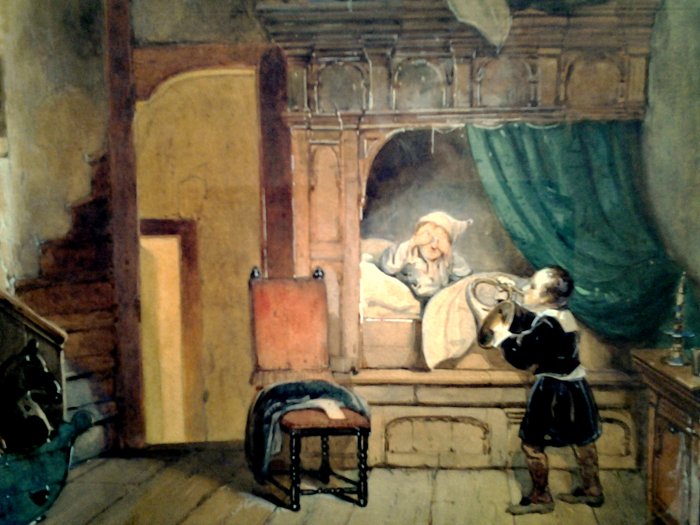
Where is `stairs`? The width and height of the screenshot is (700, 525). stairs is located at coordinates (92, 192).